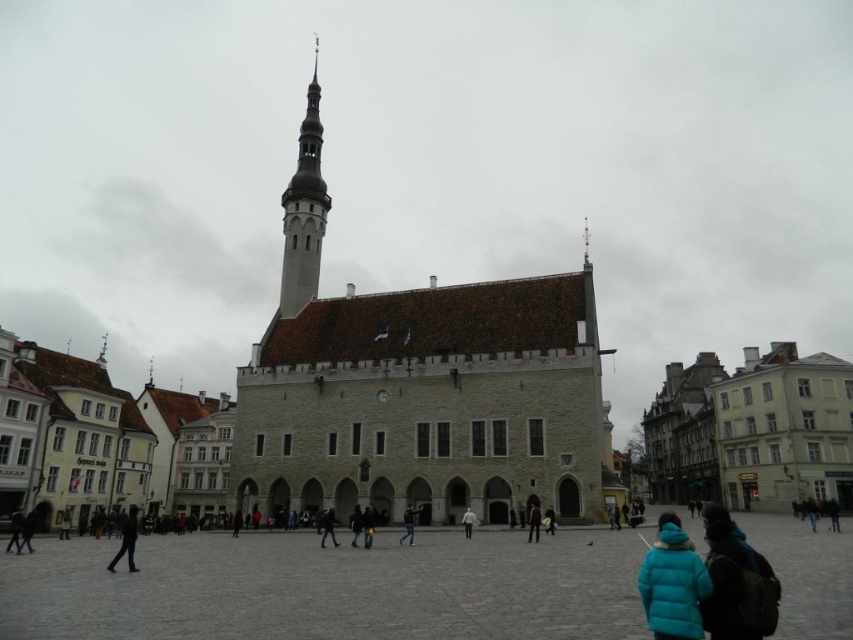
You are standing in the historic square and want to find the teal matte jacket at lower right. Which direction should you look relative to the black matte person at lower left?

The teal matte jacket at lower right is located above the black matte person at lower left, so you should look upward in the direction of the teal matte jacket at lower right.

You are a delivery person standing in the historic square and need to deliver a package to someone wearing a teal matte jacket at lower right. However, there is another person wearing a teal down jacket at lower right nearby. How far apart are these two individuals?

The teal matte jacket at lower right and the teal down jacket at lower right are 3.19 meters apart.

You are a photographer planning to take a group photo of two people wearing teal jackets in the historic square. The teal matte jacket at lower right and the teal down jacket at lower right are both present. Considering their positions and sizes, which jacket is narrower and would require more careful framing to avoid being overshadowed by the other?

The teal matte jacket at lower right has a lesser width compared to the teal down jacket at lower right, so it would require more careful framing to avoid being overshadowed by the teal down jacket at lower right.